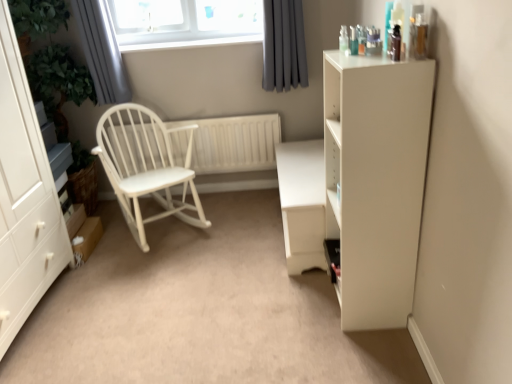
The width and height of the screenshot is (512, 384). Identify the location of vacant space to the right of white wood rocking chair at left. (242, 230).